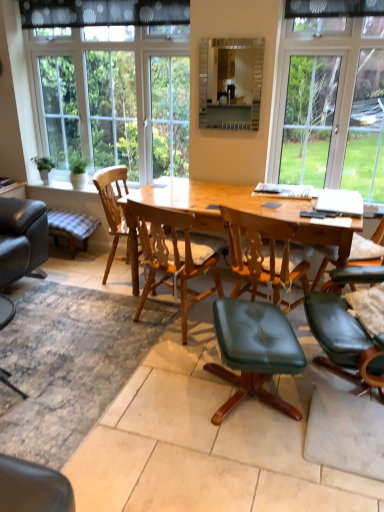
This screenshot has height=512, width=384. Find the location of `free space to the right of black plastic remote control at center`. free space to the right of black plastic remote control at center is located at coordinates (334, 211).